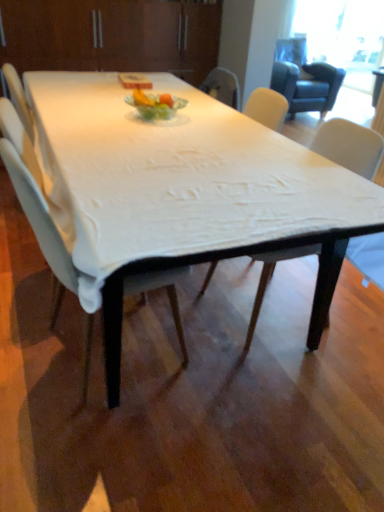
Question: From a real-world perspective, is white glass plate at center below transparent glass window screen at upper right?

Choices:
 (A) no
 (B) yes

Answer: (A)

Question: Can you confirm if white glass plate at center is taller than transparent glass window screen at upper right?

Choices:
 (A) no
 (B) yes

Answer: (A)

Question: Can you confirm if white glass plate at center is wider than transparent glass window screen at upper right?

Choices:
 (A) no
 (B) yes

Answer: (B)

Question: Is white glass plate at center far away from transparent glass window screen at upper right?

Choices:
 (A) yes
 (B) no

Answer: (A)

Question: Can you confirm if white glass plate at center is positioned to the right of transparent glass window screen at upper right?

Choices:
 (A) yes
 (B) no

Answer: (B)

Question: From the image's perspective, would you say white glass plate at center is shown under transparent glass window screen at upper right?

Choices:
 (A) yes
 (B) no

Answer: (A)

Question: From the image's perspective, would you say white fabric table at center is shown under white fabric chair at center, acting as the second chair starting from the right?

Choices:
 (A) no
 (B) yes

Answer: (A)

Question: Considering the relative positions of white fabric table at center and white fabric chair at center, arranged as the 1th chair when viewed from the left, in the image provided, is white fabric table at center to the left of white fabric chair at center, arranged as the 1th chair when viewed from the left, from the viewer's perspective?

Choices:
 (A) no
 (B) yes

Answer: (B)

Question: Is white fabric table at center with white fabric chair at center, arranged as the 1th chair when viewed from the left?

Choices:
 (A) yes
 (B) no

Answer: (B)

Question: Does white fabric table at center have a greater height compared to white fabric chair at center, arranged as the 1th chair when viewed from the left?

Choices:
 (A) yes
 (B) no

Answer: (A)

Question: Is white fabric table at center thinner than white fabric chair at center, arranged as the 1th chair when viewed from the left?

Choices:
 (A) no
 (B) yes

Answer: (B)

Question: Would you say white fabric table at center is a long distance from white fabric chair at center, arranged as the 1th chair when viewed from the left?

Choices:
 (A) no
 (B) yes

Answer: (B)

Question: Is white fabric chair at center, acting as the second chair starting from the right, completely or partially inside white glass plate at center?

Choices:
 (A) no
 (B) yes

Answer: (A)